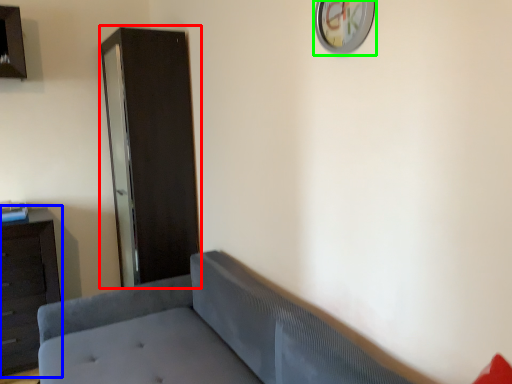
Question: Estimate the real-world distances between objects in this image. Which object is closer to file cabinet (highlighted by a red box), dresser (highlighted by a blue box) or clock (highlighted by a green box)?

Choices:
 (A) dresser
 (B) clock

Answer: (A)